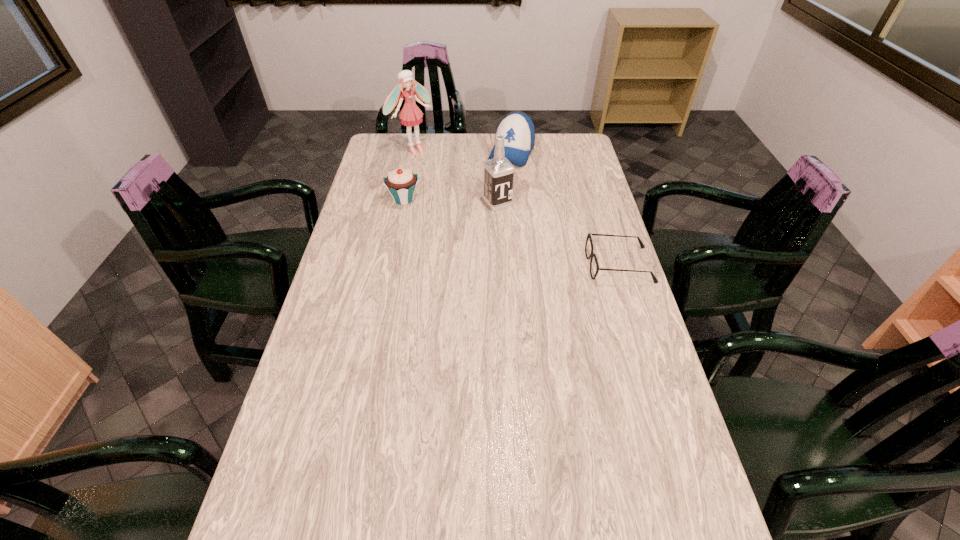
The height and width of the screenshot is (540, 960). In order to click on vacant space on the desktop that is between the cupcake and the rightmost object and is positioned on the front-facing side of the doll in this screenshot , I will do `click(501, 229)`.

Where is `free spot on the desktop that is between the cupcake and the nearest object and is positioned on the front-facing side of the baseball cap`? This screenshot has height=540, width=960. free spot on the desktop that is between the cupcake and the nearest object and is positioned on the front-facing side of the baseball cap is located at coordinates (476, 221).

Find the location of a particular element. Image resolution: width=960 pixels, height=540 pixels. free space on the desktop that is between the cupcake and the nearest object and is positioned on the front label of the second tallest object is located at coordinates (525, 237).